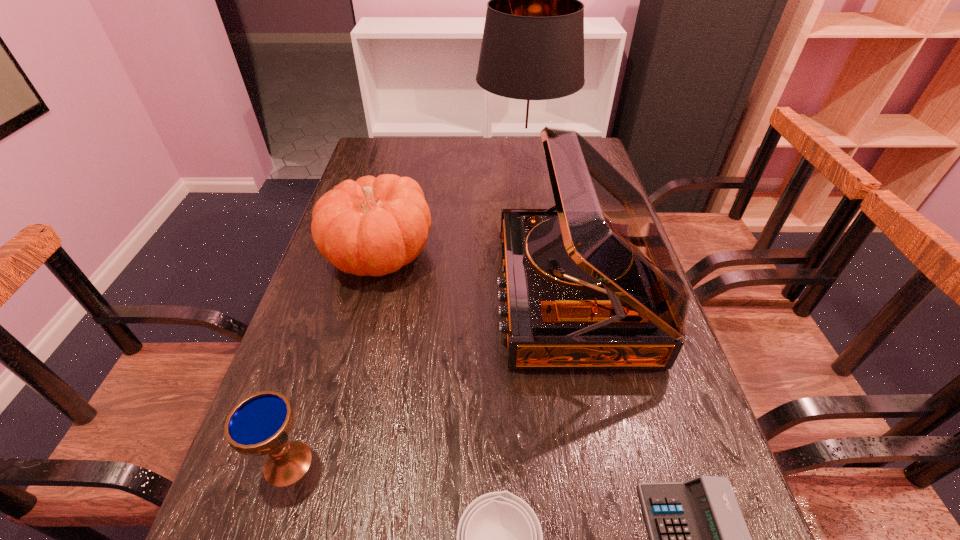
Where is `lampshade`? The height and width of the screenshot is (540, 960). lampshade is located at coordinates (532, 54).

This screenshot has height=540, width=960. I want to click on the tallest object, so click(532, 54).

Locate an element on the screen. The width and height of the screenshot is (960, 540). the fifth shortest object is located at coordinates (589, 283).

Where is `pumpkin`? pumpkin is located at coordinates (372, 226).

You are a GUI agent. You are given a task and a screenshot of the screen. Output one action in this format:
    pyautogui.click(x=<x>, y=<y>)
    Task: Click on the chalice
    The width and height of the screenshot is (960, 540).
    Given the screenshot: What is the action you would take?
    pyautogui.click(x=260, y=424)

At what (x,y) coordinates should I click in order to perform the action: click on vacant region located 0.060m on the left of the tallest object. Please return your answer as a coordinate pair (x, y). Looking at the image, I should click on pos(459,164).

Where is `vacant space located on the front-facing side of the record player`? The image size is (960, 540). vacant space located on the front-facing side of the record player is located at coordinates (392, 295).

Locate an element on the screen. The image size is (960, 540). vacant area located 0.390m on the front-facing side of the record player is located at coordinates (333, 295).

What are the coordinates of `blank area located on the front-facing side of the record player` in the screenshot? It's located at (374, 295).

Locate an element on the screen. This screenshot has width=960, height=540. free space located on the front of the pumpkin is located at coordinates (365, 314).